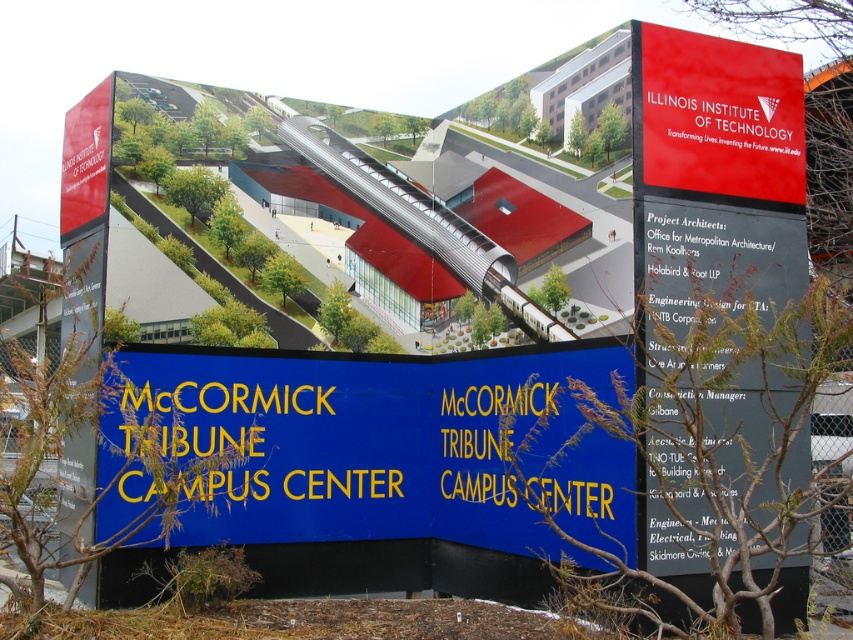
You are a visitor at the McCormick Tribune Campus Center and want to locate the black matte sign at upper right and the red matte sign at upper right. Which one is positioned to the left when viewed from the front of the signboard?

The black matte sign at upper right is positioned to the left of the red matte sign at upper right when viewed from the front of the signboard.

Consider the image. You are a visitor at the McCormick Tribune Campus Center and want to read both the blue metallic sign at center and the black matte sign at upper right. Which sign should you stand closer to in order to read them both clearly?

Since the blue metallic sign at center is larger than the black matte sign at upper right, you can stand closer to the black matte sign at upper right to read both clearly.

You are a visitor at the McCormick Tribune Campus Center and want to read both the blue metallic sign at center and the red matte sign at upper right. Which sign should you look at first if you want to read them in the order they appear from left to right?

You should look at the blue metallic sign at center first because it is positioned to the left of the red matte sign at upper right, making it the leftmost sign in the left to right order.